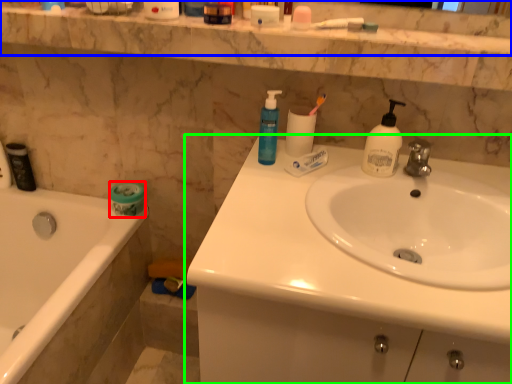
Question: Which object is positioned closest to toilet paper (highlighted by a red box)? Select from balustrade (highlighted by a blue box) and sink (highlighted by a green box).

Choices:
 (A) balustrade
 (B) sink

Answer: (A)